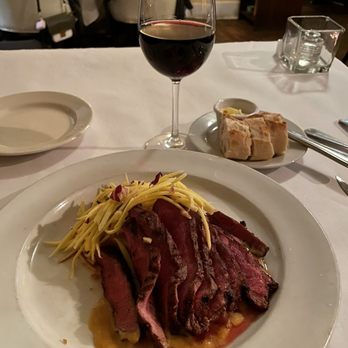
You are a GUI agent. You are given a task and a screenshot of the screen. Output one action in this format:
    pyautogui.click(x=<x>, y=<y>)
    Task: Click on the knife handle
    
    Given the screenshot: What is the action you would take?
    pyautogui.click(x=338, y=154)